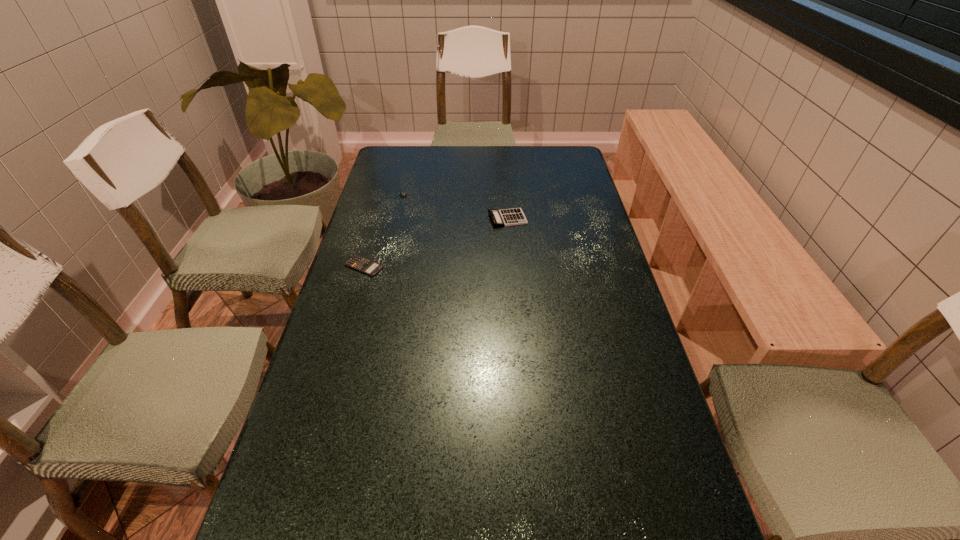
Identify the location of vacant region between the nearer calculator and the tallest object. This screenshot has height=540, width=960. (436, 242).

Locate an element on the screen. The width and height of the screenshot is (960, 540). vacant area that lies between the nearer calculator and the mouse is located at coordinates (385, 232).

This screenshot has width=960, height=540. I want to click on empty space that is in between the right calculator and the shortest object, so click(436, 242).

This screenshot has width=960, height=540. In order to click on vacant space in between the shorter calculator and the second nearest object in this screenshot , I will do `click(436, 242)`.

Locate an element on the screen. The height and width of the screenshot is (540, 960). object that is the closest to the second tallest object is located at coordinates (507, 217).

Image resolution: width=960 pixels, height=540 pixels. Identify the location of object that ranks as the second closest to the mouse. (357, 262).

Where is `vacant area that satisfies the following two spatial constraints: 1. on the front side of the mouse; 2. on the left side of the second nearest object`? This screenshot has width=960, height=540. vacant area that satisfies the following two spatial constraints: 1. on the front side of the mouse; 2. on the left side of the second nearest object is located at coordinates (400, 218).

The image size is (960, 540). Find the location of `vacant area in the image that satisfies the following two spatial constraints: 1. on the front side of the taller calculator; 2. on the right side of the mouse`. vacant area in the image that satisfies the following two spatial constraints: 1. on the front side of the taller calculator; 2. on the right side of the mouse is located at coordinates (400, 218).

At what (x,y) coordinates should I click in order to perform the action: click on free space that satisfies the following two spatial constraints: 1. on the front side of the rightmost object; 2. on the right side of the farthest object. Please return your answer as a coordinate pair (x, y). This screenshot has width=960, height=540. Looking at the image, I should click on pos(400,218).

Find the location of a particular element. Image resolution: width=960 pixels, height=540 pixels. free space that satisfies the following two spatial constraints: 1. on the front side of the farthest object; 2. on the left side of the taller calculator is located at coordinates (400, 218).